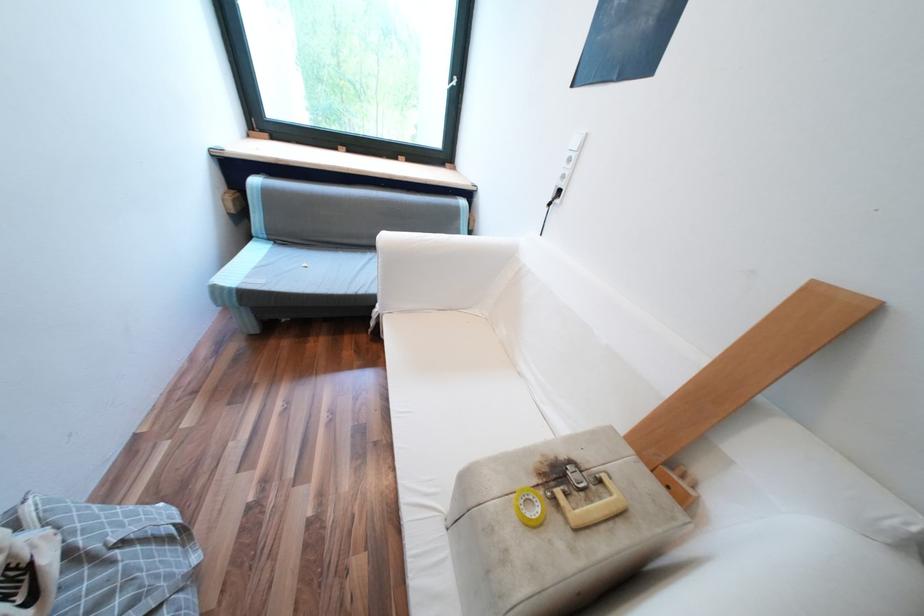
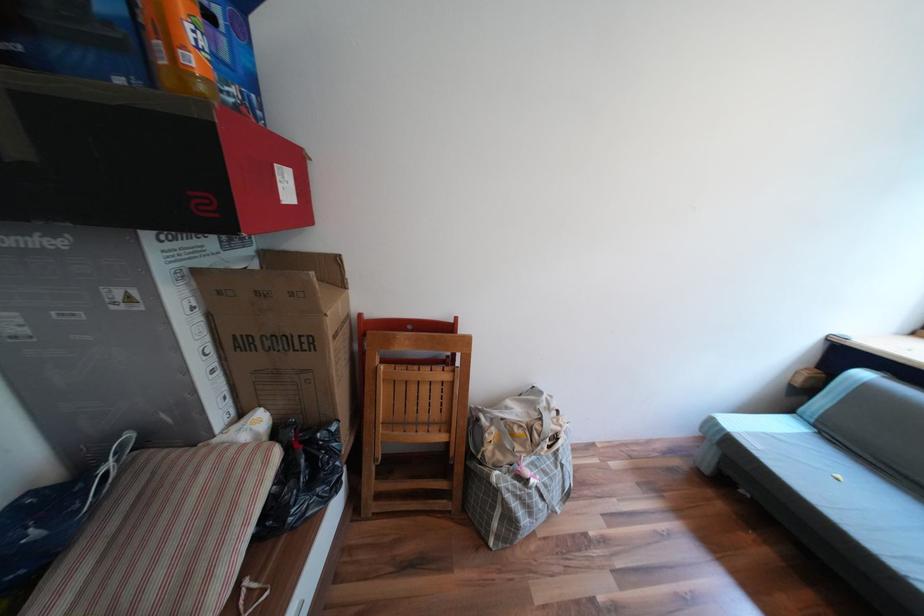
Find the pixel in the second image that matches (x=238, y=288) in the first image.

(733, 428)